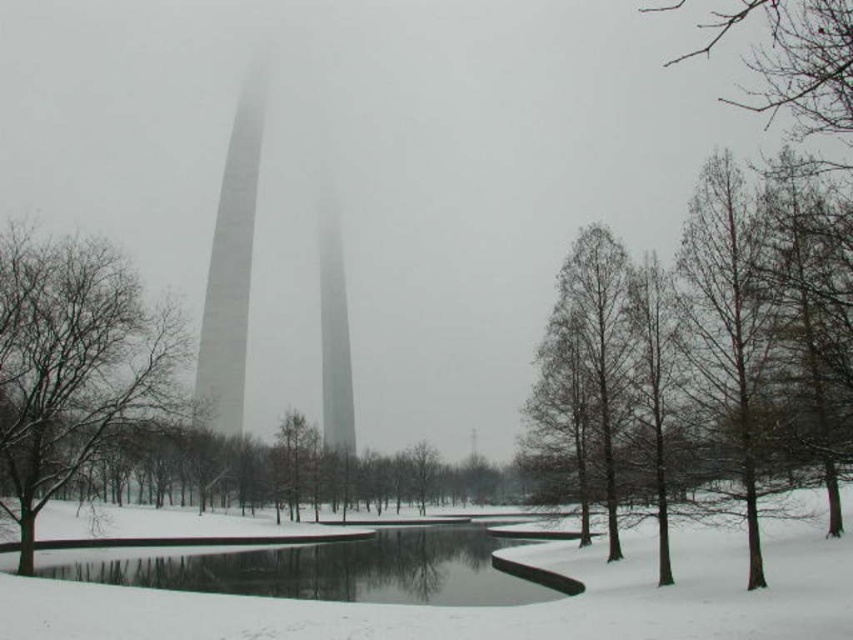
Between brown bark tree at right and white smooth tower at center, which one is positioned higher?

white smooth tower at center is higher up.

Which of these two, brown bark tree at right or white smooth tower at center, stands shorter?

brown bark tree at right is shorter.

Is point (842, 349) less distant than point (254, 157)?

Yes, it is.

The width and height of the screenshot is (853, 640). In order to click on brown bark tree at right in this screenshot , I will do `click(712, 364)`.

Does brown bark tree at right have a smaller size compared to snow-covered tree at left?

Incorrect, brown bark tree at right is not smaller in size than snow-covered tree at left.

Does brown bark tree at right lie in front of snow-covered tree at left?

That is True.

Which is in front, point (796, 198) or point (35, 284)?

Positioned in front is point (796, 198).

This screenshot has height=640, width=853. Identify the location of brown bark tree at right. (712, 364).

Which is below, snow-covered tree at left or black smooth pond at center?

black smooth pond at center is below.

Who is positioned more to the right, snow-covered tree at left or black smooth pond at center?

Positioned to the right is black smooth pond at center.

What do you see at coordinates (73, 365) in the screenshot?
I see `snow-covered tree at left` at bounding box center [73, 365].

Locate an element on the screen. The height and width of the screenshot is (640, 853). snow-covered tree at left is located at coordinates (73, 365).